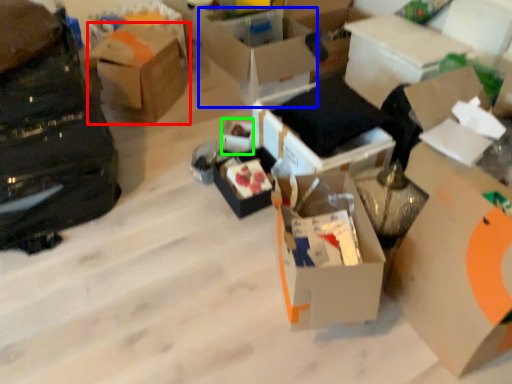
Question: Based on their relative distances, which object is nearer to box (highlighted by a red box)? Choose from box (highlighted by a blue box) and storage box (highlighted by a green box).

Choices:
 (A) box
 (B) storage box

Answer: (A)